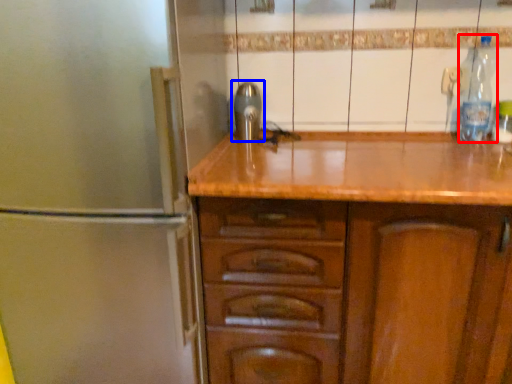
Question: Which object is further to the camera taking this photo, bottle (highlighted by a red box) or tap (highlighted by a blue box)?

Choices:
 (A) bottle
 (B) tap

Answer: (B)